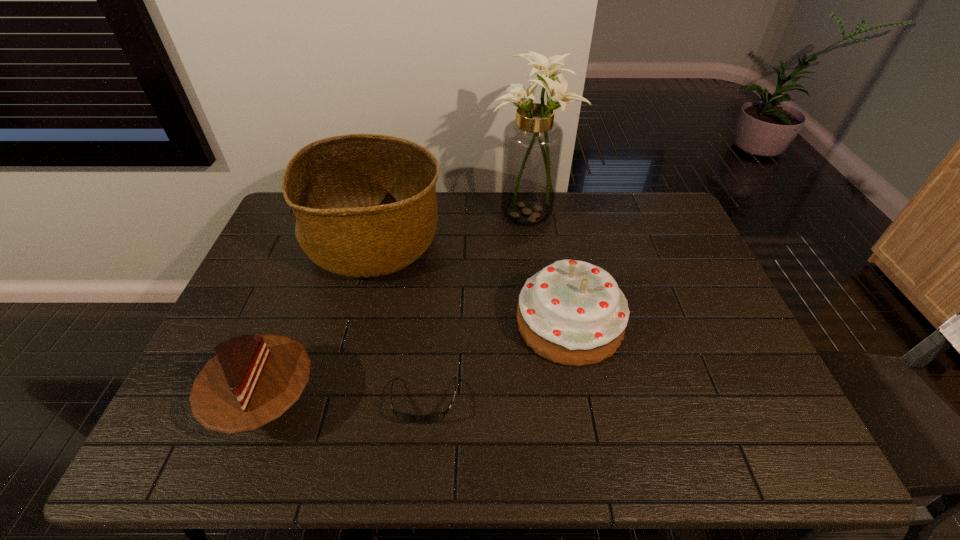
At what (x,y) coordinates should I click in order to perform the action: click on vacant area that lies between the sunglasses and the tallest object. Please return your answer as a coordinate pair (x, y). Image resolution: width=960 pixels, height=540 pixels. Looking at the image, I should click on (x=477, y=307).

Locate an element on the screen. Image resolution: width=960 pixels, height=540 pixels. vacant area that lies between the flower arrangement and the shortest object is located at coordinates (477, 307).

Locate which object ranks fourth in proximity to the right cake. Please provide its 2D coordinates. Your answer should be formatted as a tuple, i.e. [(x, y)], where the tuple contains the x and y coordinates of a point satisfying the conditions above.

[(252, 380)]

Find the location of a particular element. This screenshot has height=540, width=960. object that can be found as the fourth closest to the flower arrangement is located at coordinates (252, 380).

This screenshot has height=540, width=960. What are the coordinates of `vacant space that satisfies the following two spatial constraints: 1. on the front side of the tallest object; 2. on the left side of the right cake` in the screenshot? It's located at pyautogui.click(x=546, y=324).